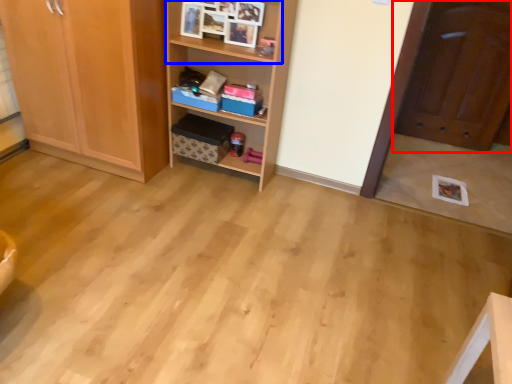
Question: Which of the following is the farthest to the observer, door (highlighted by a red box) or cabinet (highlighted by a blue box)?

Choices:
 (A) door
 (B) cabinet

Answer: (A)